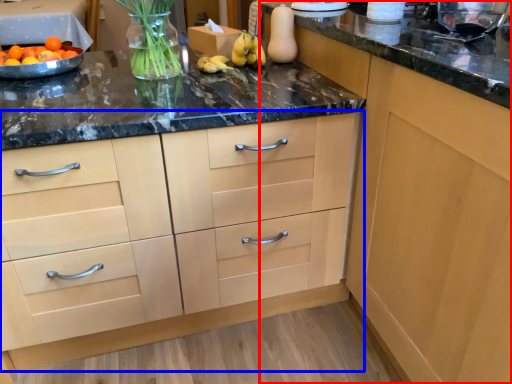
Question: Which object is further to the camera taking this photo, cabinetry (highlighted by a red box) or cabinetry (highlighted by a blue box)?

Choices:
 (A) cabinetry
 (B) cabinetry

Answer: (B)